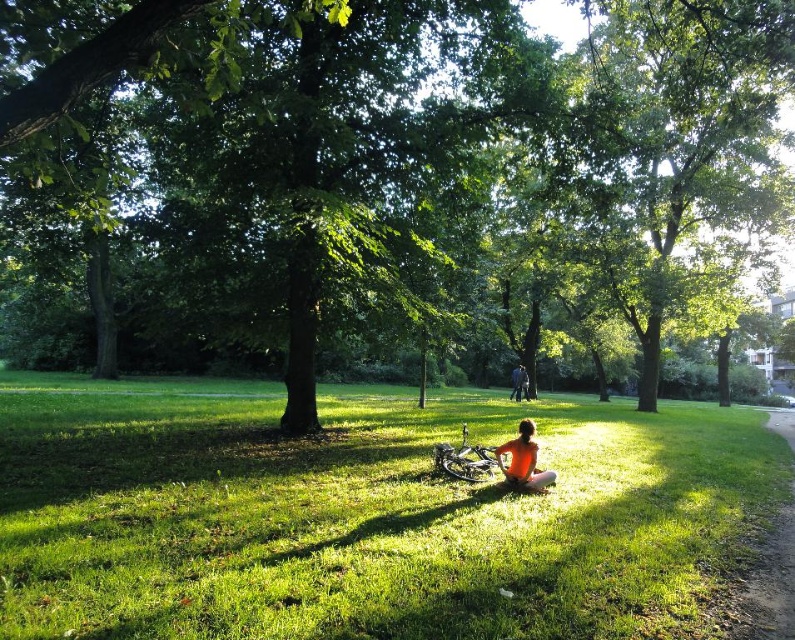
Locate an element on the screen. The image size is (795, 640). green grassy at center is located at coordinates (365, 515).

Who is more distant from viewer, (631, 614) or (534, 484)?

Positioned behind is point (534, 484).

Find the location of a particular element. This screenshot has height=640, width=795. green grassy at center is located at coordinates (365, 515).

Between green leafy tree at center and green grassy at center, which one appears on the left side from the viewer's perspective?

From the viewer's perspective, green grassy at center appears more on the left side.

Can you confirm if green leafy tree at center is taller than green grassy at center?

Indeed, green leafy tree at center has a greater height compared to green grassy at center.

Who is more distant from viewer, (679,205) or (501,602)?

Point (679,205)

I want to click on green leafy tree at center, so click(x=384, y=164).

In the scene shown: Which of these two, green leafy tree at center or dark blue jeans at center, stands shorter?

With less height is dark blue jeans at center.

Does green leafy tree at center have a lesser height compared to dark blue jeans at center?

No, green leafy tree at center is not shorter than dark blue jeans at center.

Is point (626, 134) positioned before point (520, 385)?

Yes.

In order to click on green leafy tree at center in this screenshot , I will do `click(384, 164)`.